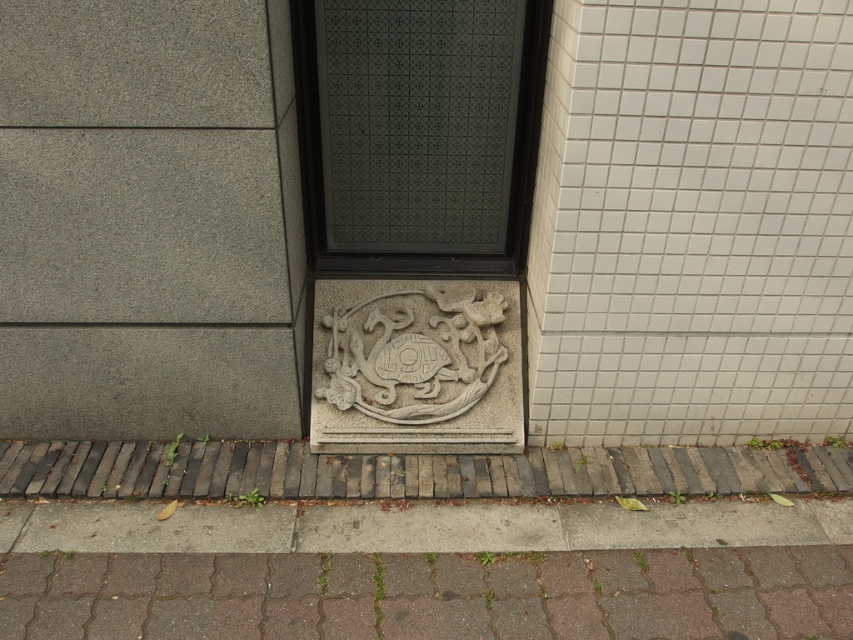
From the picture: Is the position of brown brick pavement at lower center less distant than that of gray stone carving at center?

That is True.

Does brown brick pavement at lower center have a lesser width compared to gray stone carving at center?

Incorrect, brown brick pavement at lower center's width is not less than gray stone carving at center's.

Which is in front, point (480, 589) or point (432, 364)?

Point (480, 589) is more forward.

The image size is (853, 640). In order to click on brown brick pavement at lower center in this screenshot , I will do `click(432, 595)`.